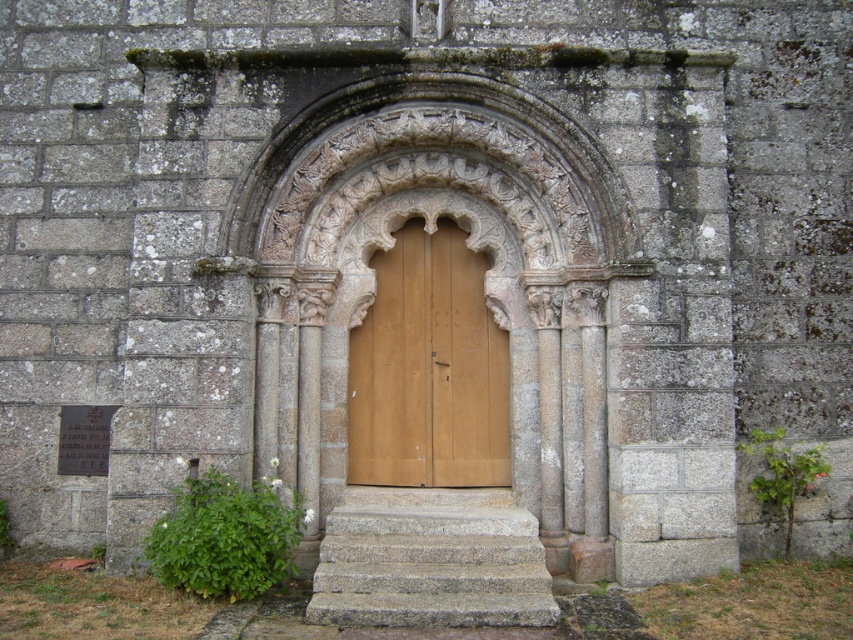
You are standing in front of the stone archway and want to take a photo of the point at coordinates point (428, 458). If your camera has a maximum focus range of 10 meters, will it be able to focus on that point?

The point at point (428, 458) is 9.06 meters away from the camera. Since the camera can focus up to 10 meters, it will be able to focus on the point.

From the picture: You are a tour guide explaining the historical building to visitors. You point out the wooden door at center and the gray stone stairs at center. Which one is smaller in size?

The wooden door at center is smaller than the gray stone stairs at center.